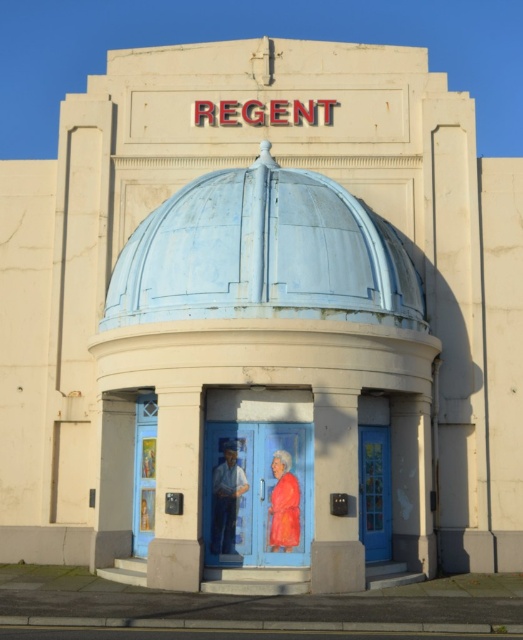
You are an architect assessing the Regent building facade. You notice two doors at the center. Which door is shorter in height between the blue painted door at center and the blue glass door at center?

The blue painted door at center is shorter in height compared to the blue glass door at center.

You are standing in front of the Regent building and want to place a small flower pot at each of the two specified points. The flower pots are both 10 cm in height. If you want to ensure that the flower pot at point [252,545] is visible from your current position, will the flower pot at point [363,524] block its view?

Point [252,545] is closer to the viewer than point [363,524]. Since the flower pot at point [252,545] is closer, it will not be blocked by the flower pot at point [363,524], so it will remain visible from your current position.

You are a delivery person trying to enter the Regent building. You see the blue painted door at center and the matte blue statue at center. Which one should you approach to enter the building?

The blue painted door at center is larger than the matte blue statue at center, so you should approach the blue painted door at center to enter the building.